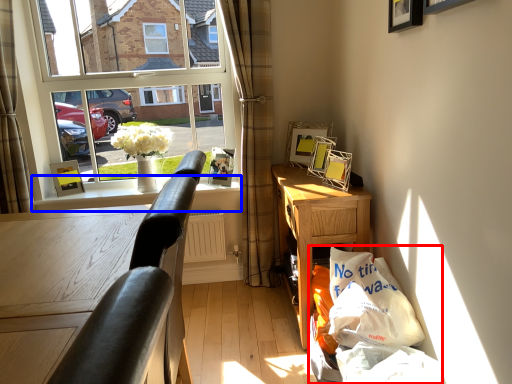
Question: Which object appears closest to the camera in this image, shopping bag (highlighted by a red box) or window sill (highlighted by a blue box)?

Choices:
 (A) shopping bag
 (B) window sill

Answer: (A)